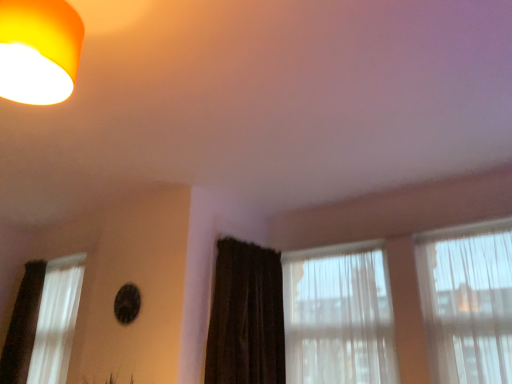
Question: In terms of size, does white sheer curtain at left, arranged as the first window when viewed from the left, appear bigger or smaller than matte orange lampshade at upper left?

Choices:
 (A) big
 (B) small

Answer: (A)

Question: Would you say white sheer curtain at left, arranged as the first window when viewed from the left, is to the left or to the right of matte orange lampshade at upper left in the picture?

Choices:
 (A) right
 (B) left

Answer: (B)

Question: Which object is the farthest from the translucent fabric curtain at center, positioned as the 2th window in left-to-right order?

Choices:
 (A) dark brown textured curtain at center
 (B) matte orange lampshade at upper left
 (C) white sheer curtain at left, the third window in the right-to-left sequence
 (D) translucent fabric curtain at right, placed as the first window when sorted from right to left

Answer: (B)

Question: Considering the real-world distances, which object is closest to the dark brown textured curtain at center?

Choices:
 (A) translucent fabric curtain at center, positioned as the second window in right-to-left order
 (B) white sheer curtain at left, the third window in the right-to-left sequence
 (C) translucent fabric curtain at right, placed as the first window when sorted from right to left
 (D) matte orange lampshade at upper left

Answer: (A)